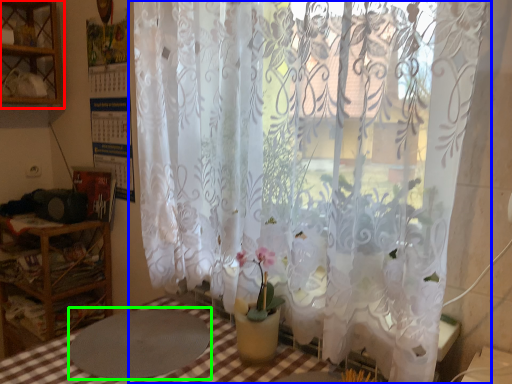
Question: Estimate the real-world distances between objects in this image. Which object is closer to shelf (highlighted by a red box), curtain (highlighted by a blue box) or round table (highlighted by a green box)?

Choices:
 (A) curtain
 (B) round table

Answer: (A)